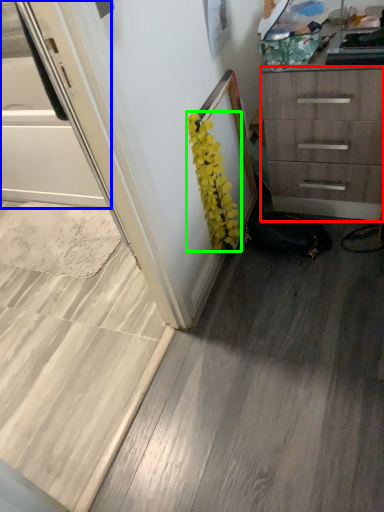
Question: Estimate the real-world distances between objects in this image. Which object is closer to chest of drawers (highlighted by a red box), screen door (highlighted by a blue box) or flower (highlighted by a green box)?

Choices:
 (A) screen door
 (B) flower

Answer: (B)